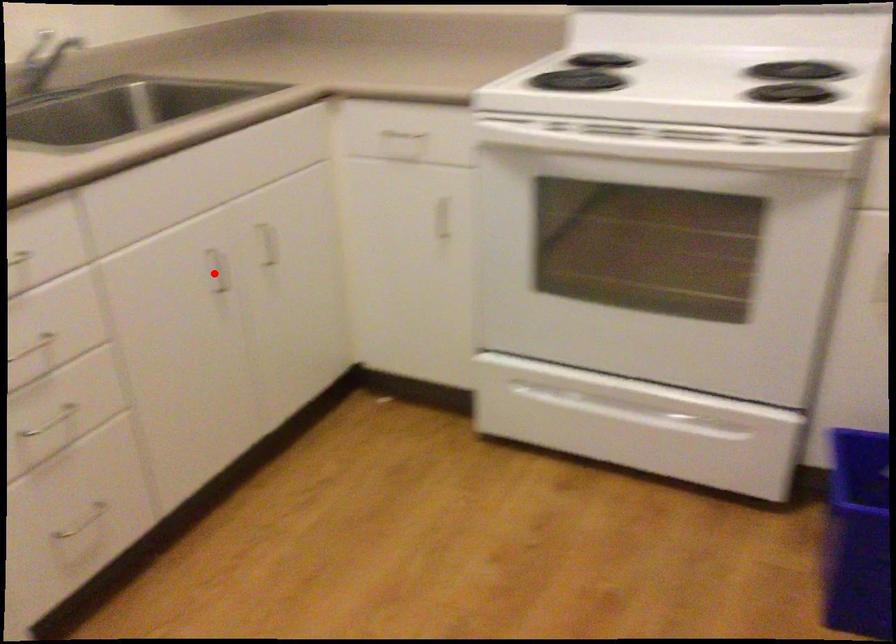
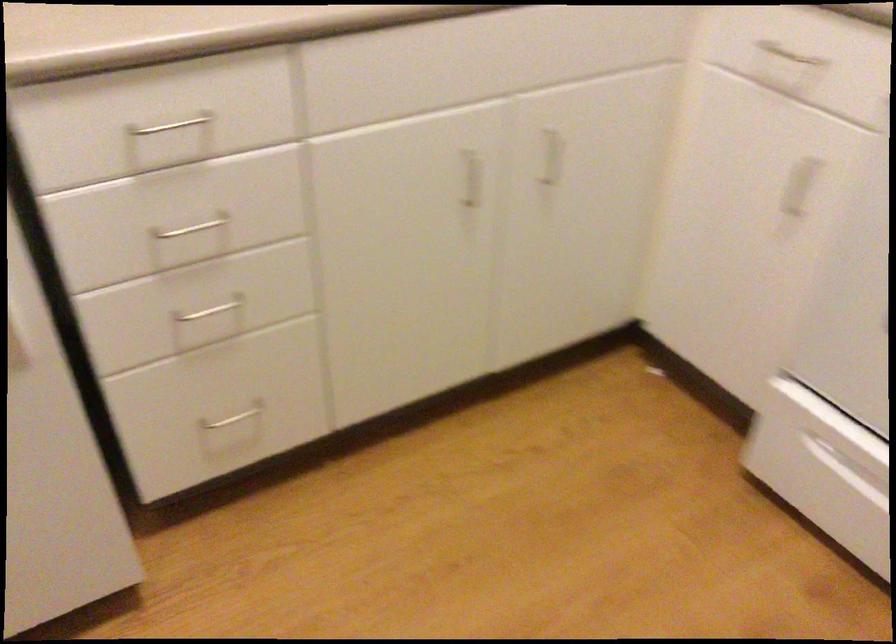
Find the pixel in the second image that matches the highlighted location in the first image.

(471, 178)